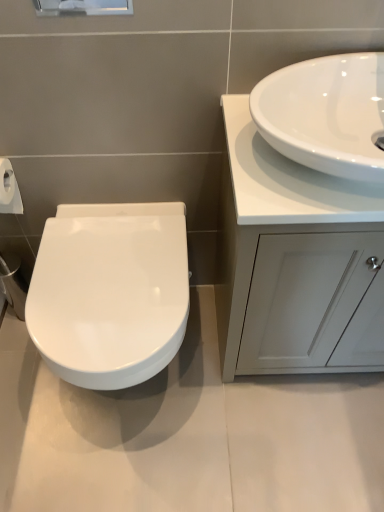
Question: Looking at their shapes, would you say white glossy sink at upper right is wider or thinner than white glossy cabinet at right?

Choices:
 (A) thin
 (B) wide

Answer: (A)

Question: In terms of size, does white glossy sink at upper right appear bigger or smaller than white glossy cabinet at right?

Choices:
 (A) small
 (B) big

Answer: (A)

Question: Which object is positioned farthest from the white glossy cabinet at right?

Choices:
 (A) white glossy toilet at left
 (B) white glossy sink at upper right

Answer: (A)

Question: Which is nearer to the white glossy cabinet at right?

Choices:
 (A) white glossy toilet at left
 (B) white glossy sink at upper right

Answer: (B)